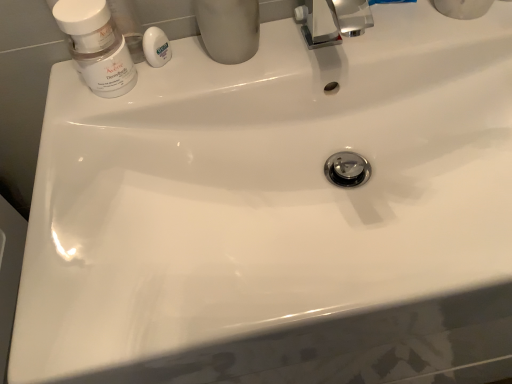
Locate an element on the screen. The image size is (512, 384). vacant area located to the right-hand side of white glossy soap at upper center is located at coordinates (267, 56).